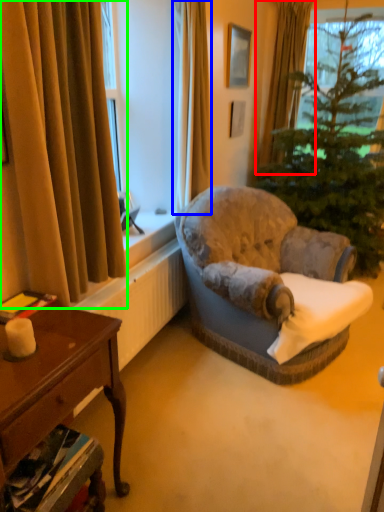
Question: Considering the real-world distances, which object is closest to curtain (highlighted by a red box)? curtain (highlighted by a blue box) or curtain (highlighted by a green box).

Choices:
 (A) curtain
 (B) curtain

Answer: (A)